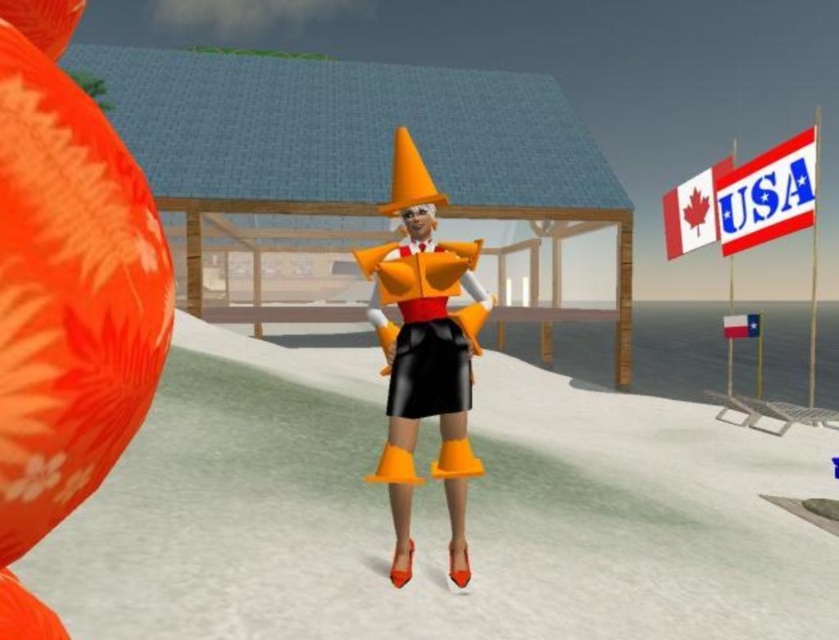
You are a character in the winter scene and want to place a new flag between the white paper flag at upper right and the red fabric flag at lower right. Which flag should you place your new flag to the left of?

You should place your new flag to the left of the red fabric flag at lower right because the white paper flag at upper right is already on its left side.

You are a winter festival attendee standing in the snow. You notice the matte orange cone at center and the red fabric flag at lower right. Which object is taller?

The matte orange cone at center is taller than the red fabric flag at lower right.

You are a game developer creating a winter scene. You need to place a snowman exactly at the center of the image. The snowman must be placed at the same position as the matte orange cone at center. What are the coordinates where you should place the snowman?

The coordinates for the matte orange cone at center are at point (425, 353), so you should place the snowman at those coordinates as well.